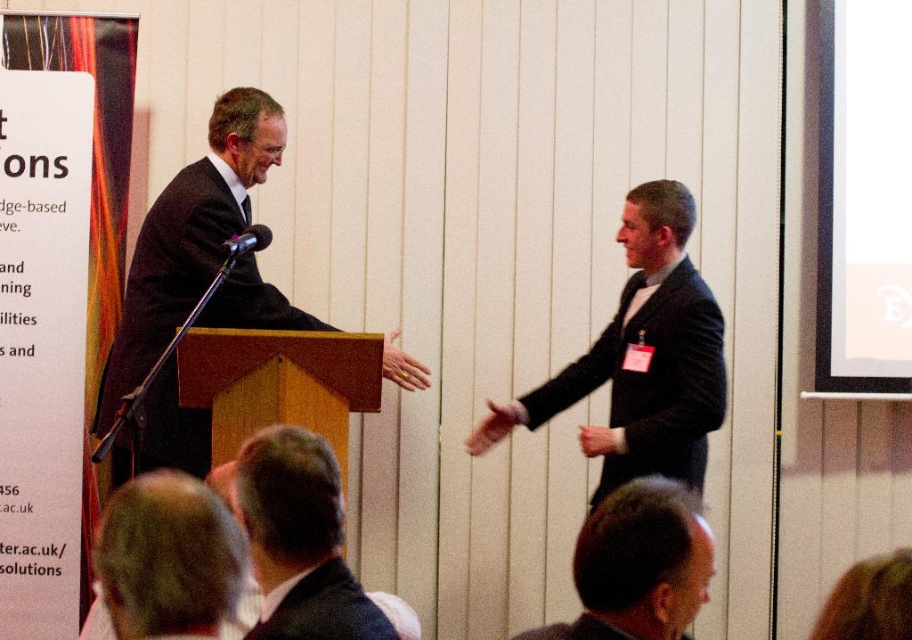
You are an event planner standing at the back of the room. You need to ensure that the black matte suit at right and the black matte microphone at center are visible to all attendees. Based on their heights, which one might block the view of the other?

The black matte suit at right is taller than the black matte microphone at center, so the black matte suit at right could potentially block the view of the microphone if positioned in front of it.

You are a photographer at the event and need to capture a photo where both the black matte suit at right and the dark brown hair at lower center are visible. Given their height difference, which one might appear larger in the photo?

The black matte suit at right is much taller than the dark brown hair at lower center, so it will appear larger in the photo.

You are an event organizer trying to identify the speaker. You see the black matte suit at right and the dark brown hair at lower center. Which one is the speaker?

The black matte suit at right is the speaker because they are positioned over the dark brown hair at lower center, indicating they are standing in front and addressing the audience.